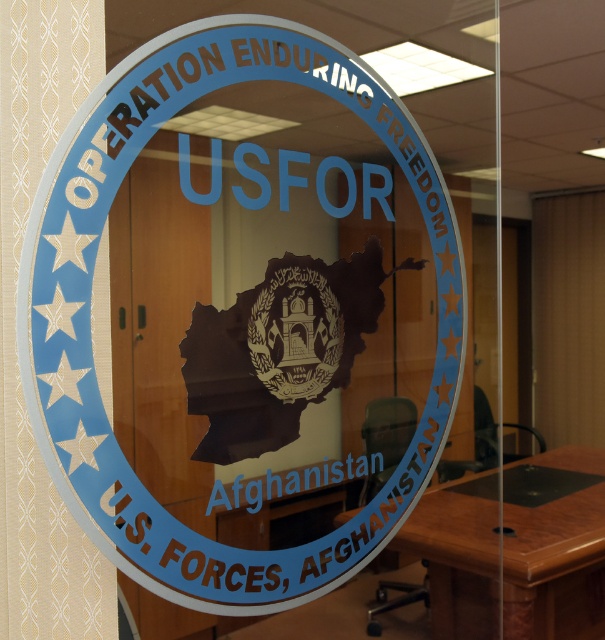
Question: Which point is closer to the camera taking this photo?

Choices:
 (A) (178, 531)
 (B) (302, 371)
 (C) (537, 579)

Answer: (A)

Question: Which object is the farthest from the blue glossy sticker at center?

Choices:
 (A) brown wooden table at lower right
 (B) brown textured emblem at center

Answer: (A)

Question: Does brown wooden table at lower right appear under brown textured emblem at center?

Choices:
 (A) yes
 (B) no

Answer: (A)

Question: Among these points, which one is nearest to the camera?

Choices:
 (A) (440, 493)
 (B) (299, 65)

Answer: (B)

Question: From the image, what is the correct spatial relationship of blue glossy sticker at center in relation to brown textured emblem at center?

Choices:
 (A) below
 (B) above

Answer: (B)

Question: Does brown wooden table at lower right have a larger size compared to brown textured emblem at center?

Choices:
 (A) yes
 (B) no

Answer: (A)